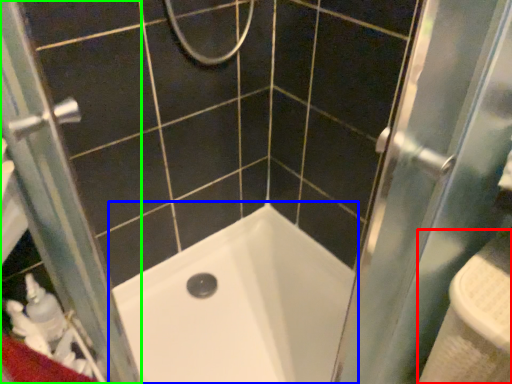
Question: Which object is the closest to the sink (highlighted by a red box)? Choose among these: bathtub (highlighted by a blue box) or screen door (highlighted by a green box).

Choices:
 (A) bathtub
 (B) screen door

Answer: (A)